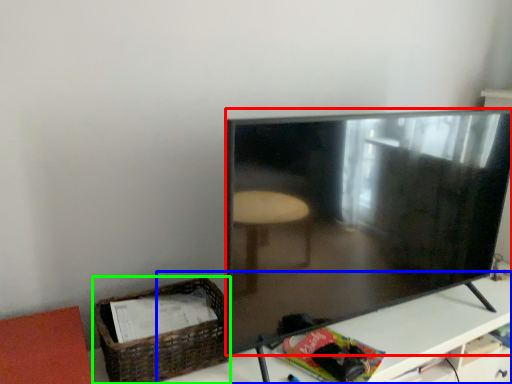
Question: Which is farther away from television (highlighted by a red box)? table (highlighted by a blue box) or basket (highlighted by a green box)?

Choices:
 (A) table
 (B) basket

Answer: (B)